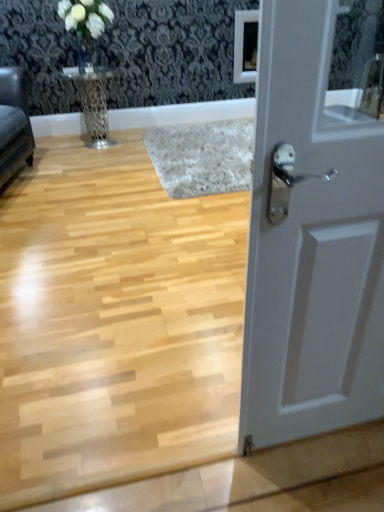
Question: From a real-world perspective, is white matte door at right positioned above or below velvet dark gray sofa at left?

Choices:
 (A) below
 (B) above

Answer: (B)

Question: Does point [284, 436] appear closer or farther from the camera than point [13, 162]?

Choices:
 (A) farther
 (B) closer

Answer: (B)

Question: Estimate the real-world distances between objects in this image. Which object is farther from the velvet dark gray sofa at left?

Choices:
 (A) metallic silver table at upper left
 (B) white matte door at right
 (C) clear glass vase at upper left

Answer: (B)

Question: Estimate the real-world distances between objects in this image. Which object is farther from the velvet dark gray sofa at left?

Choices:
 (A) metallic silver table at upper left
 (B) white matte door at right
 (C) clear glass vase at upper left

Answer: (B)